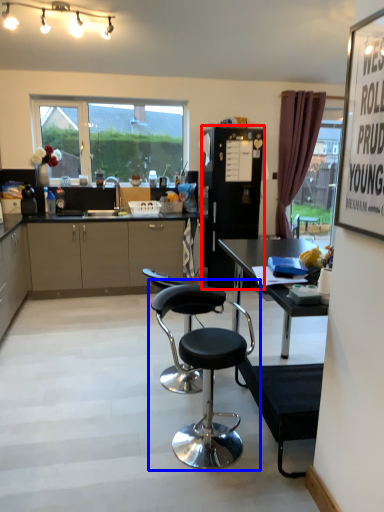
Question: Which object appears farthest to the camera in this image, appliance (highlighted by a red box) or chair (highlighted by a blue box)?

Choices:
 (A) appliance
 (B) chair

Answer: (A)